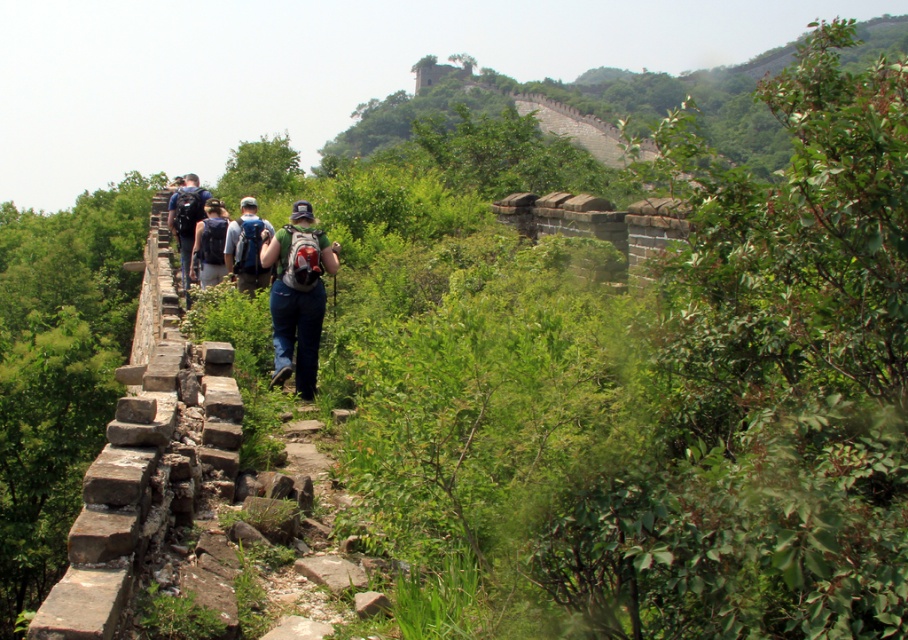
Question: Does denim jeans at center have a larger size compared to matte gray backpack at center?

Choices:
 (A) yes
 (B) no

Answer: (A)

Question: Which of the following is the farthest from the observer?

Choices:
 (A) dark blue jeans at center
 (B) denim jeans at center

Answer: (A)

Question: Considering the real-world distances, which object is closest to the matte gray backpack at center?

Choices:
 (A) dark blue backpack at center
 (B) dark blue jeans at center

Answer: (A)

Question: Does matte gray backpack at center appear on the left side of dark blue backpack at center?

Choices:
 (A) yes
 (B) no

Answer: (B)

Question: Which point is closer to the camera?

Choices:
 (A) dark blue backpack at center
 (B) dark blue jeans at center

Answer: (A)

Question: Does denim jeans at center come behind dark blue backpack at center?

Choices:
 (A) yes
 (B) no

Answer: (B)